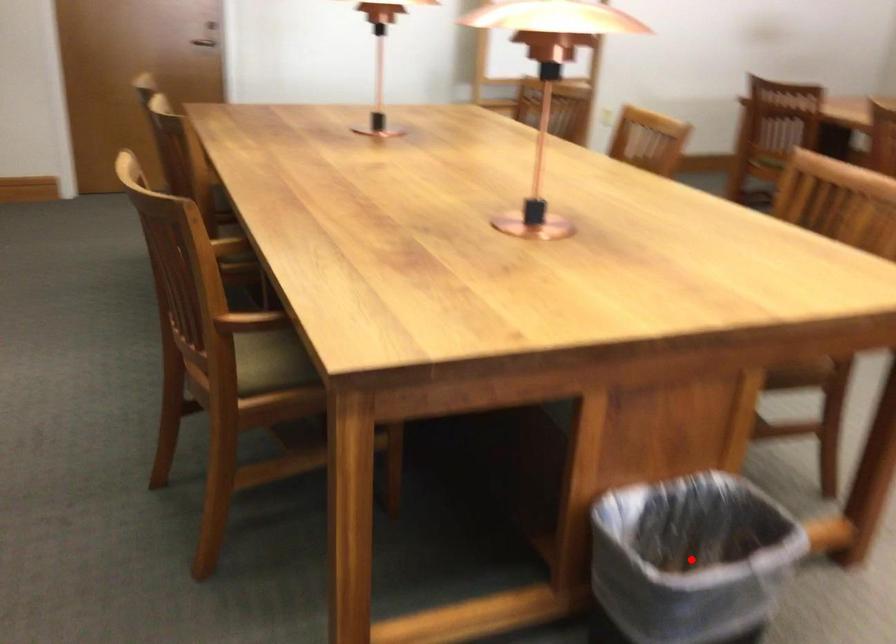
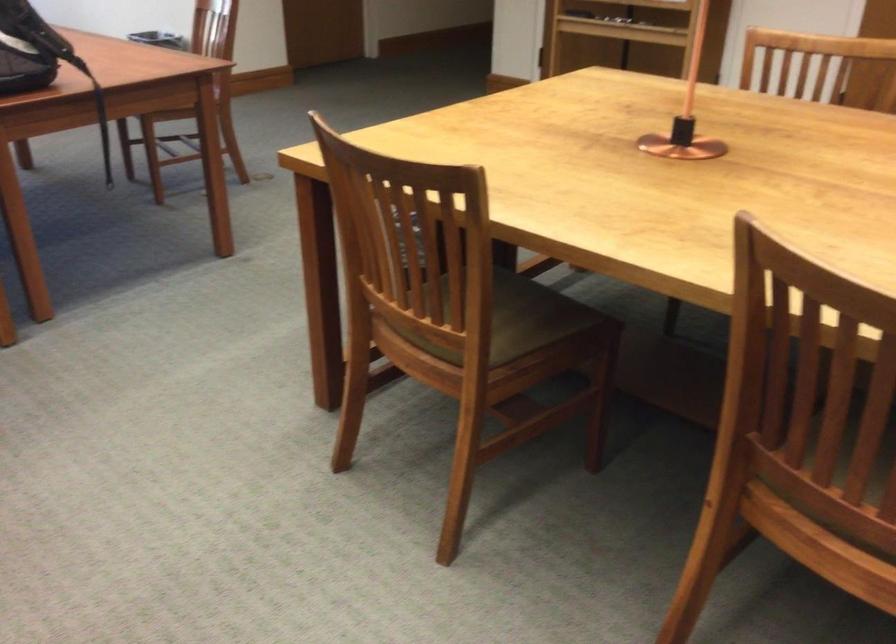
Question: I am providing you with two images of the same scene from different viewpoints. A red point is marked on the first image. At the location where the point appears in image 1, is it still visible in image 2?

Choices:
 (A) Yes
 (B) No

Answer: (B)